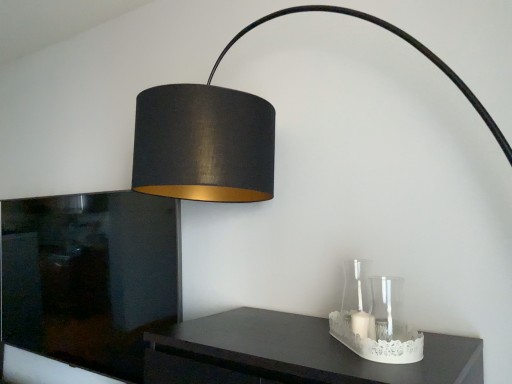
Question: From the image's perspective, would you say clear glass candle holder at lower right, which is the second glass vase in front-to-back order, is positioned over transparent glass vase at lower right, which is the second glass vase from back to front?

Choices:
 (A) yes
 (B) no

Answer: (B)

Question: Considering the relative sizes of clear glass candle holder at lower right, which appears as the 1th glass vase when viewed from the back, and transparent glass vase at lower right, which is the second glass vase from back to front, in the image provided, is clear glass candle holder at lower right, which appears as the 1th glass vase when viewed from the back, bigger than transparent glass vase at lower right, which is the second glass vase from back to front,?

Choices:
 (A) yes
 (B) no

Answer: (A)

Question: Can you confirm if clear glass candle holder at lower right, which appears as the 1th glass vase when viewed from the back, is wider than transparent glass vase at lower right, acting as the first glass vase starting from the front?

Choices:
 (A) yes
 (B) no

Answer: (A)

Question: Is clear glass candle holder at lower right, which appears as the 1th glass vase when viewed from the back, closer to camera compared to transparent glass vase at lower right, which is the second glass vase from back to front?

Choices:
 (A) no
 (B) yes

Answer: (A)

Question: Does clear glass candle holder at lower right, which is the second glass vase in front-to-back order, have a lesser height compared to transparent glass vase at lower right, which is the second glass vase from back to front?

Choices:
 (A) yes
 (B) no

Answer: (B)

Question: From a real-world perspective, is clear glass candle holder at lower right, which appears as the 1th glass vase when viewed from the back, on transparent glass vase at lower right, acting as the first glass vase starting from the front?

Choices:
 (A) no
 (B) yes

Answer: (B)

Question: Is transparent glass vase at lower right, acting as the first glass vase starting from the front, positioned with its back to clear glass candle holder at lower right, which appears as the 1th glass vase when viewed from the back?

Choices:
 (A) no
 (B) yes

Answer: (A)

Question: Is transparent glass vase at lower right, which is the second glass vase from back to front, aimed at clear glass candle holder at lower right, which is the second glass vase in front-to-back order?

Choices:
 (A) yes
 (B) no

Answer: (B)

Question: Is transparent glass vase at lower right, acting as the first glass vase starting from the front, at the right side of clear glass candle holder at lower right, which is the second glass vase in front-to-back order?

Choices:
 (A) no
 (B) yes

Answer: (B)

Question: Considering the relative sizes of transparent glass vase at lower right, acting as the first glass vase starting from the front, and clear glass candle holder at lower right, which is the second glass vase in front-to-back order, in the image provided, is transparent glass vase at lower right, acting as the first glass vase starting from the front, smaller than clear glass candle holder at lower right, which is the second glass vase in front-to-back order,?

Choices:
 (A) no
 (B) yes

Answer: (B)

Question: Considering the relative sizes of transparent glass vase at lower right, which is the second glass vase from back to front, and clear glass candle holder at lower right, which appears as the 1th glass vase when viewed from the back, in the image provided, is transparent glass vase at lower right, which is the second glass vase from back to front, thinner than clear glass candle holder at lower right, which appears as the 1th glass vase when viewed from the back,?

Choices:
 (A) yes
 (B) no

Answer: (A)

Question: From the image's perspective, is transparent glass vase at lower right, acting as the first glass vase starting from the front, above clear glass candle holder at lower right, which is the second glass vase in front-to-back order?

Choices:
 (A) yes
 (B) no

Answer: (A)

Question: In terms of height, does clear glass candle holder at lower right, which appears as the 1th glass vase when viewed from the back, look taller or shorter compared to transparent glass vase at lower right, acting as the first glass vase starting from the front?

Choices:
 (A) tall
 (B) short

Answer: (A)